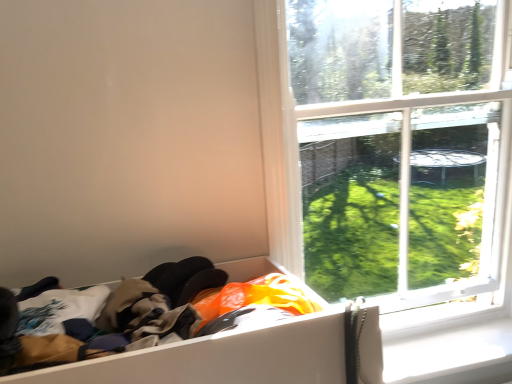
Question: Can you confirm if white plastic window sill at lower right is taller than transparent glass window at upper right?

Choices:
 (A) yes
 (B) no

Answer: (B)

Question: From the image's perspective, is white plastic window sill at lower right located above transparent glass window at upper right?

Choices:
 (A) no
 (B) yes

Answer: (A)

Question: Can you confirm if white plastic window sill at lower right is thinner than transparent glass window at upper right?

Choices:
 (A) yes
 (B) no

Answer: (B)

Question: From a real-world perspective, is white plastic window sill at lower right under transparent glass window at upper right?

Choices:
 (A) yes
 (B) no

Answer: (A)

Question: Is white plastic window sill at lower right closer to the viewer compared to transparent glass window at upper right?

Choices:
 (A) yes
 (B) no

Answer: (B)

Question: Is the position of white plastic window sill at lower right more distant than that of transparent glass window at upper right?

Choices:
 (A) yes
 (B) no

Answer: (A)

Question: Does white plastic window sill at lower right have a larger size compared to white cardboard box at lower left?

Choices:
 (A) yes
 (B) no

Answer: (B)

Question: From a real-world perspective, is white plastic window sill at lower right positioned over white cardboard box at lower left based on gravity?

Choices:
 (A) no
 (B) yes

Answer: (A)

Question: Is white plastic window sill at lower right outside white cardboard box at lower left?

Choices:
 (A) no
 (B) yes

Answer: (B)

Question: Is white plastic window sill at lower right surrounding white cardboard box at lower left?

Choices:
 (A) no
 (B) yes

Answer: (A)

Question: Is white plastic window sill at lower right to the right of white cardboard box at lower left from the viewer's perspective?

Choices:
 (A) no
 (B) yes

Answer: (B)

Question: Is white plastic window sill at lower right thinner than white cardboard box at lower left?

Choices:
 (A) yes
 (B) no

Answer: (A)

Question: From the image's perspective, is white cardboard box at lower left on transparent glass window at upper right?

Choices:
 (A) no
 (B) yes

Answer: (A)